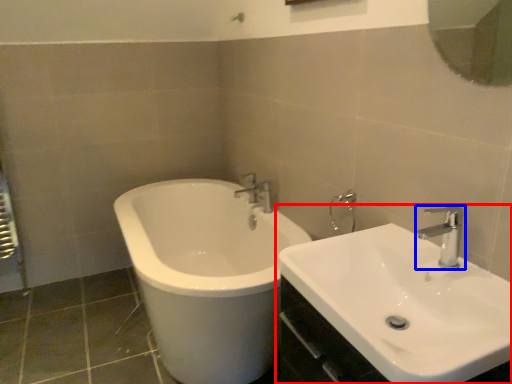
Question: Which of the following is the closest to the observer, sink (highlighted by a red box) or tap (highlighted by a blue box)?

Choices:
 (A) sink
 (B) tap

Answer: (A)